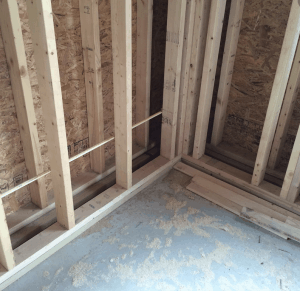
Where is `scratches on floor`? This screenshot has width=300, height=291. scratches on floor is located at coordinates (280, 285), (280, 250), (257, 241).